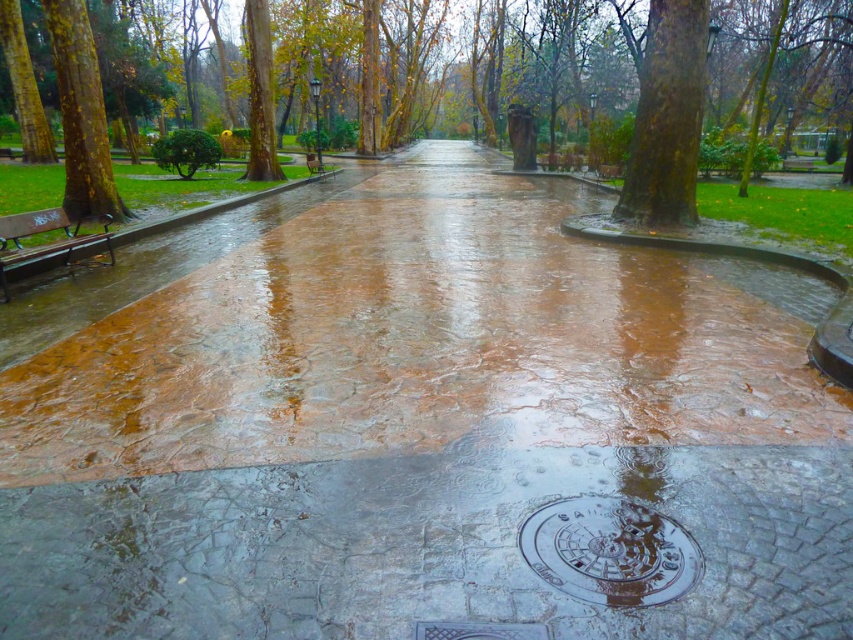
Does point (677, 67) come farther from viewer compared to point (42, 256)?

Yes, it is behind point (42, 256).

Which is above, green rough bark tree at upper right or wooden bench at left?

green rough bark tree at upper right

Does point (618, 218) come closer to viewer compared to point (21, 227)?

No, (618, 218) is further to viewer.

At what (x,y) coordinates should I click in order to perform the action: click on green rough bark tree at upper right. Please return your answer as a coordinate pair (x, y). This screenshot has width=853, height=640. Looking at the image, I should click on (666, 116).

Can you confirm if yellow-green bark tree at left is thinner than wooden bench at left?

Yes, yellow-green bark tree at left is thinner than wooden bench at left.

Consider the image. Does yellow-green bark tree at left appear on the right side of wooden bench at left?

No, yellow-green bark tree at left is not to the right of wooden bench at left.

Between point (73, 113) and point (51, 252), which one is positioned in front?

Point (51, 252) is in front.

You are a GUI agent. You are given a task and a screenshot of the screen. Output one action in this format:
    pyautogui.click(x=<x>, y=<y>)
    Task: Click on the yellow-green bark tree at left
    Image resolution: width=853 pixels, height=640 pixels.
    Given the screenshot: What is the action you would take?
    pyautogui.click(x=80, y=115)

Does brown textured tree at center have a greater width compared to wooden bench at left?

Yes, brown textured tree at center is wider than wooden bench at left.

Consider the image. Between brown textured tree at center and wooden bench at left, which one is positioned lower?

Positioned lower is wooden bench at left.

Describe the element at coordinates (614, 90) in the screenshot. This screenshot has height=640, width=853. I see `brown textured tree at center` at that location.

This screenshot has height=640, width=853. Find the location of `brown textured tree at center`. brown textured tree at center is located at coordinates (614, 90).